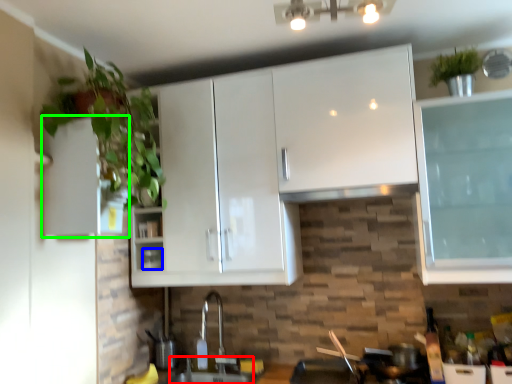
Question: Which object is positioned farthest from sink (highlighted by a red box)? Select from appliance (highlighted by a blue box) and cabinetry (highlighted by a green box).

Choices:
 (A) appliance
 (B) cabinetry

Answer: (B)